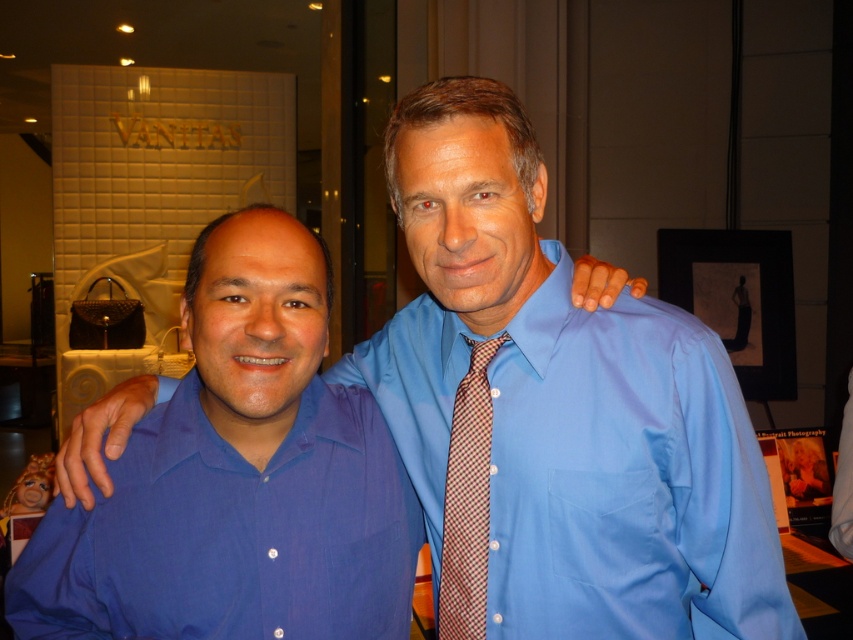
Between point (577, 328) and point (459, 440), which one is positioned behind?

Point (459, 440)

Between blue satin shirt at center and plaid silk tie at center, which one appears on the right side from the viewer's perspective?

blue satin shirt at center

Who is more forward, (618,550) or (485,490)?

Point (618,550) is in front.

You are a GUI agent. You are given a task and a screenshot of the screen. Output one action in this format:
    pyautogui.click(x=<x>, y=<y>)
    Task: Click on the blue satin shirt at center
    The height and width of the screenshot is (640, 853).
    Given the screenshot: What is the action you would take?
    pyautogui.click(x=593, y=467)

Between blue satin shirt at center and blue cotton shirt at center, which one appears on the right side from the viewer's perspective?

blue satin shirt at center is more to the right.

Who is positioned more to the left, blue satin shirt at center or blue cotton shirt at center?

blue cotton shirt at center is more to the left.

The image size is (853, 640). Find the location of `blue satin shirt at center`. blue satin shirt at center is located at coordinates (593, 467).

You are a GUI agent. You are given a task and a screenshot of the screen. Output one action in this format:
    pyautogui.click(x=<x>, y=<y>)
    Task: Click on the blue satin shirt at center
    
    Given the screenshot: What is the action you would take?
    pyautogui.click(x=593, y=467)

Does blue cotton shirt at center appear under plaid silk tie at center?

Yes.

Is blue cotton shirt at center positioned before plaid silk tie at center?

Yes, it is.

Who is more forward, (265, 604) or (476, 404)?

Point (265, 604) is more forward.

Locate an element on the screen. The image size is (853, 640). blue cotton shirt at center is located at coordinates (231, 534).